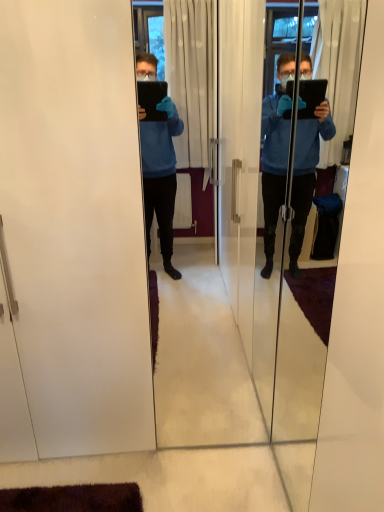
Question: Does white matte screen door at left, placed as the second screen door when sorted from right to left, touch transparent glass tablet at center, which is the 2th screen door from left to right?

Choices:
 (A) yes
 (B) no

Answer: (B)

Question: Is white matte screen door at left, placed as the second screen door when sorted from right to left, bigger than transparent glass tablet at center, which is the 2th screen door from left to right?

Choices:
 (A) no
 (B) yes

Answer: (B)

Question: Is white matte screen door at left, placed as the second screen door when sorted from right to left, taller than transparent glass tablet at center, which ranks as the first screen door in right-to-left order?

Choices:
 (A) yes
 (B) no

Answer: (A)

Question: From a real-world perspective, is white matte screen door at left, placed as the second screen door when sorted from right to left, physically below transparent glass tablet at center, which ranks as the first screen door in right-to-left order?

Choices:
 (A) no
 (B) yes

Answer: (A)

Question: Is white matte screen door at left, the 1th screen door positioned from the left, located outside transparent glass tablet at center, which ranks as the first screen door in right-to-left order?

Choices:
 (A) no
 (B) yes

Answer: (B)

Question: Is white matte screen door at left, the 1th screen door positioned from the left, surrounding transparent glass tablet at center, which ranks as the first screen door in right-to-left order?

Choices:
 (A) no
 (B) yes

Answer: (A)

Question: From a real-world perspective, is transparent glass tablet at center, which ranks as the first screen door in right-to-left order, positioned under white matte screen door at left, placed as the second screen door when sorted from right to left, based on gravity?

Choices:
 (A) no
 (B) yes

Answer: (B)

Question: Does transparent glass tablet at center, which is the 2th screen door from left to right, have a lesser height compared to white matte screen door at left, the 1th screen door positioned from the left?

Choices:
 (A) yes
 (B) no

Answer: (A)

Question: Could white matte screen door at left, the 1th screen door positioned from the left, be considered to be inside transparent glass tablet at center, which is the 2th screen door from left to right?

Choices:
 (A) yes
 (B) no

Answer: (B)

Question: Considering the relative sizes of transparent glass tablet at center, which is the 2th screen door from left to right, and white matte screen door at left, the 1th screen door positioned from the left, in the image provided, is transparent glass tablet at center, which is the 2th screen door from left to right, bigger than white matte screen door at left, the 1th screen door positioned from the left,?

Choices:
 (A) yes
 (B) no

Answer: (B)

Question: From the image's perspective, would you say transparent glass tablet at center, which ranks as the first screen door in right-to-left order, is shown under white matte screen door at left, the 1th screen door positioned from the left?

Choices:
 (A) no
 (B) yes

Answer: (B)

Question: Is white matte screen door at left, the 1th screen door positioned from the left, at the back of transparent glass tablet at center, which ranks as the first screen door in right-to-left order?

Choices:
 (A) no
 (B) yes

Answer: (A)

Question: Looking at their shapes, would you say transparent glass tablet at center, which ranks as the first screen door in right-to-left order, is wider or thinner than white matte screen door at left, the 1th screen door positioned from the left?

Choices:
 (A) wide
 (B) thin

Answer: (B)